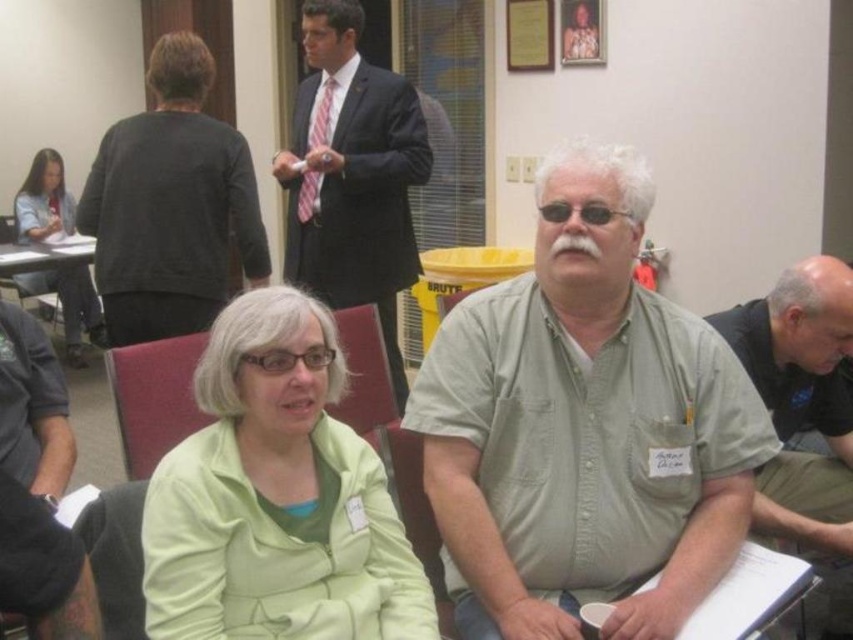
You are standing at the entrance of the conference room and want to approach the black suit at upper center and the green fabric chair at center. Which object will you encounter first as you walk towards them?

The black suit at upper center will be encountered first because it is closer to you than the green fabric chair at center.